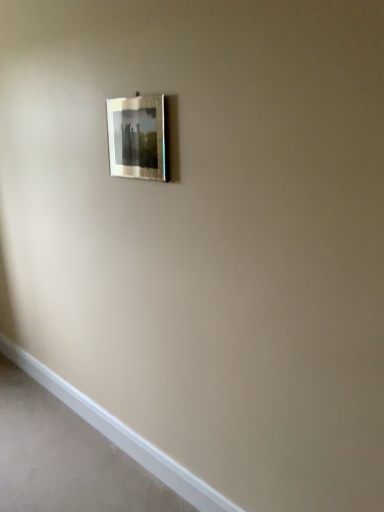
This screenshot has height=512, width=384. Describe the element at coordinates (137, 137) in the screenshot. I see `metallic silver frame at upper center` at that location.

What is the approximate height of metallic silver frame at upper center?

The height of metallic silver frame at upper center is 12.40 inches.

Image resolution: width=384 pixels, height=512 pixels. Find the location of `metallic silver frame at upper center`. metallic silver frame at upper center is located at coordinates (137, 137).

You are a GUI agent. You are given a task and a screenshot of the screen. Output one action in this format:
    pyautogui.click(x=<x>, y=<y>)
    Task: Click on the metallic silver frame at upper center
    
    Given the screenshot: What is the action you would take?
    pyautogui.click(x=137, y=137)